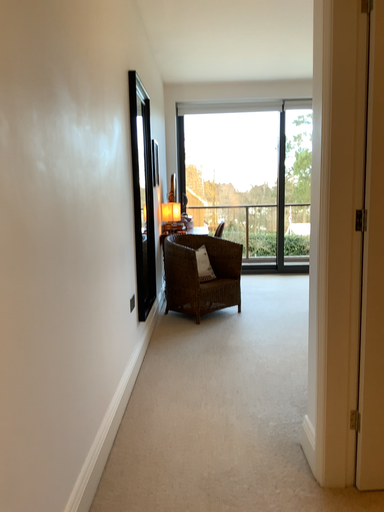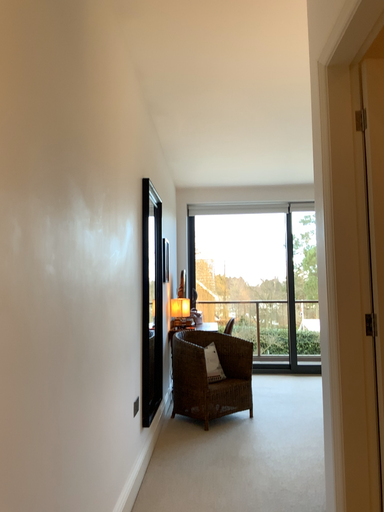
Question: Which way did the camera rotate in the video?

Choices:
 (A) rotated upward
 (B) rotated downward

Answer: (A)